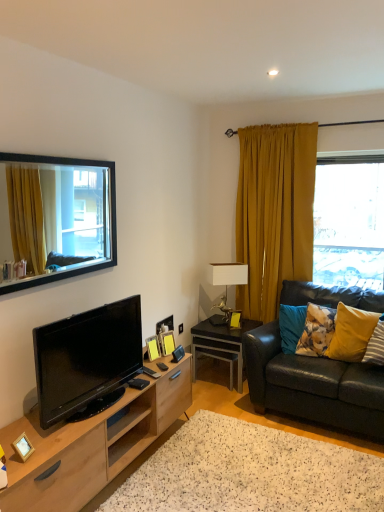
The image size is (384, 512). Identify the location of free space on the front side of wooden picture frame at center, the 2th picture frame in the left-to-right sequence. (155, 366).